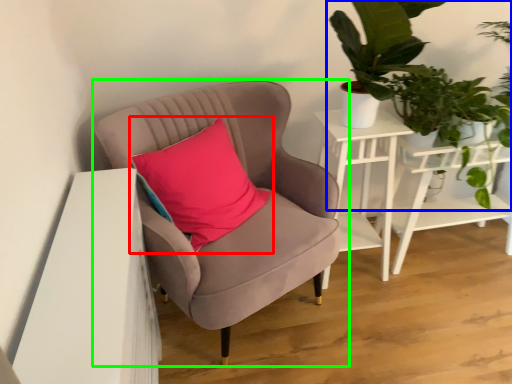
Question: Considering the real-world distances, which object is farthest from pillow (highlighted by a red box)? houseplant (highlighted by a blue box) or chair (highlighted by a green box)?

Choices:
 (A) houseplant
 (B) chair

Answer: (A)